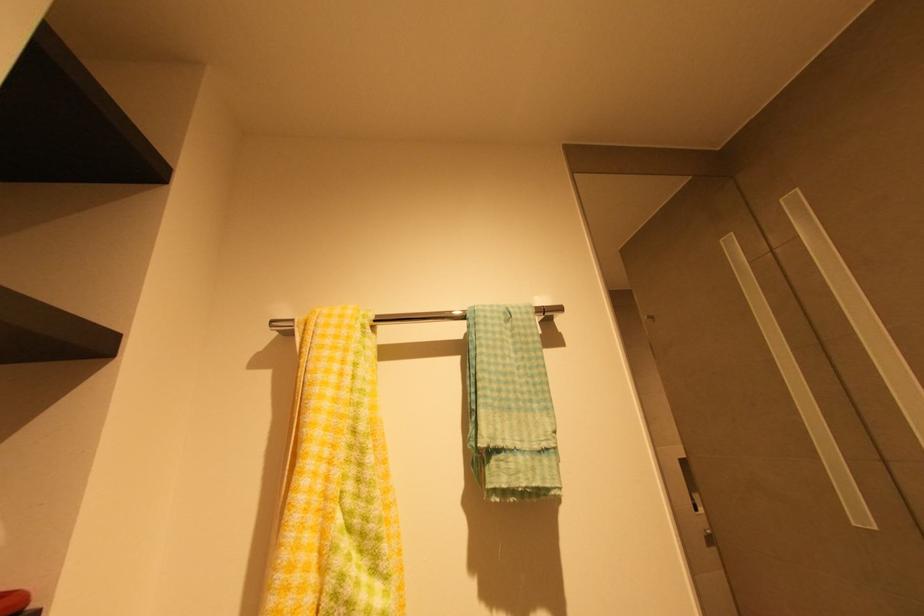
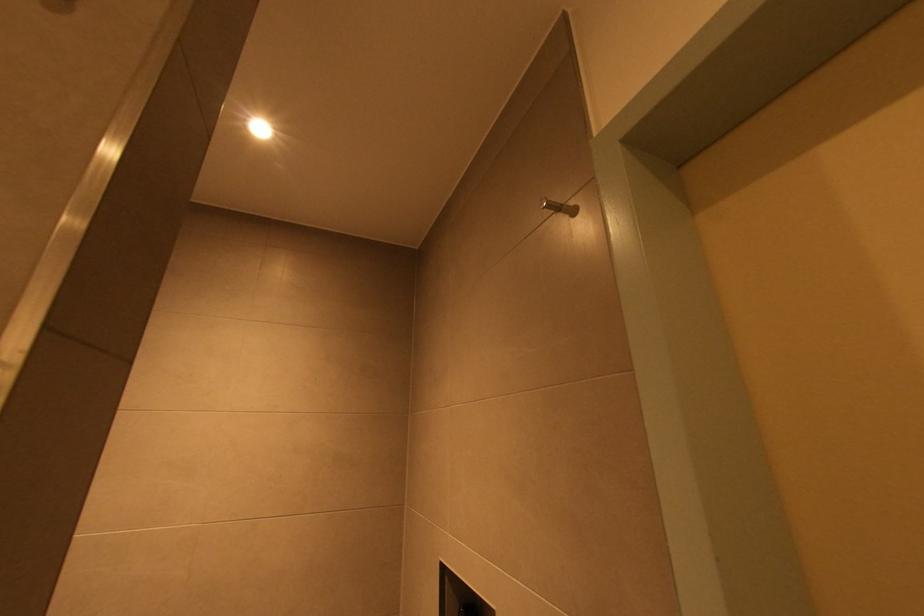
Based on the continuous images, in which direction is the camera rotating?

The camera rotated toward right-up.